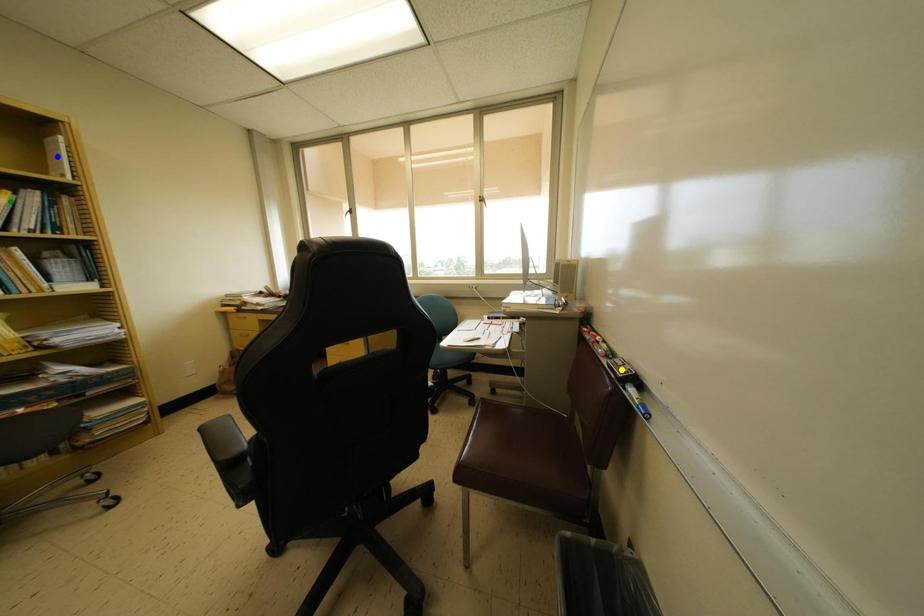
Order these from nearest to farthest:
yellow point
blue point
green point

green point < yellow point < blue point